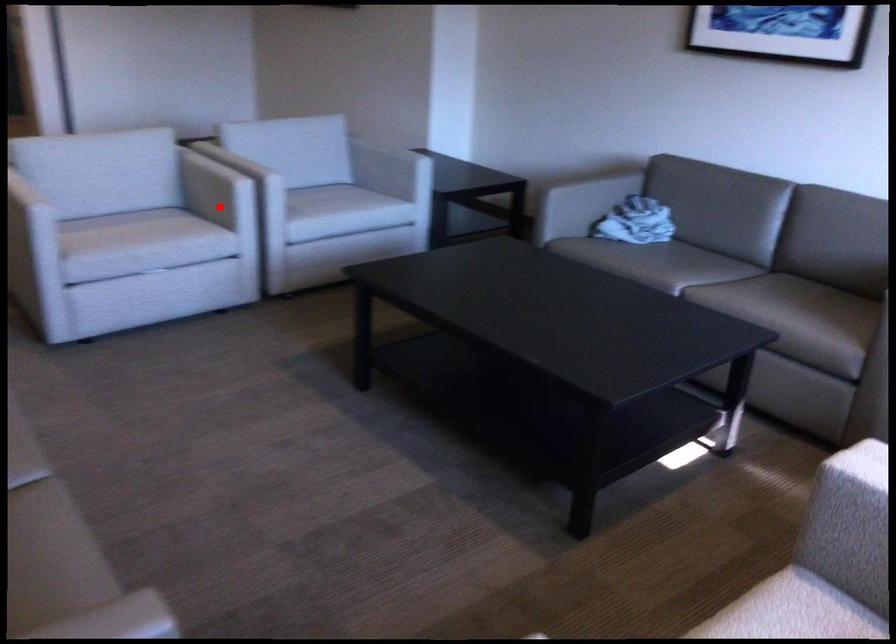
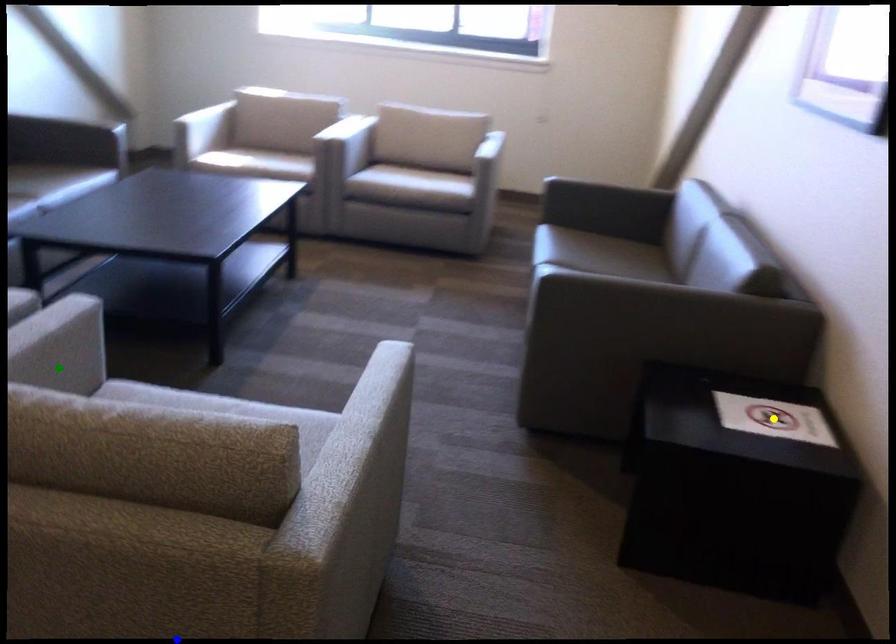
Question: I am providing you with two images of the same scene from different viewpoints. A red point is marked on the first image. You are given multiple points on the second image. Which mark in image 2 goes with the point in image 1?

Choices:
 (A) green point
 (B) yellow point
 (C) blue point

Answer: (A)